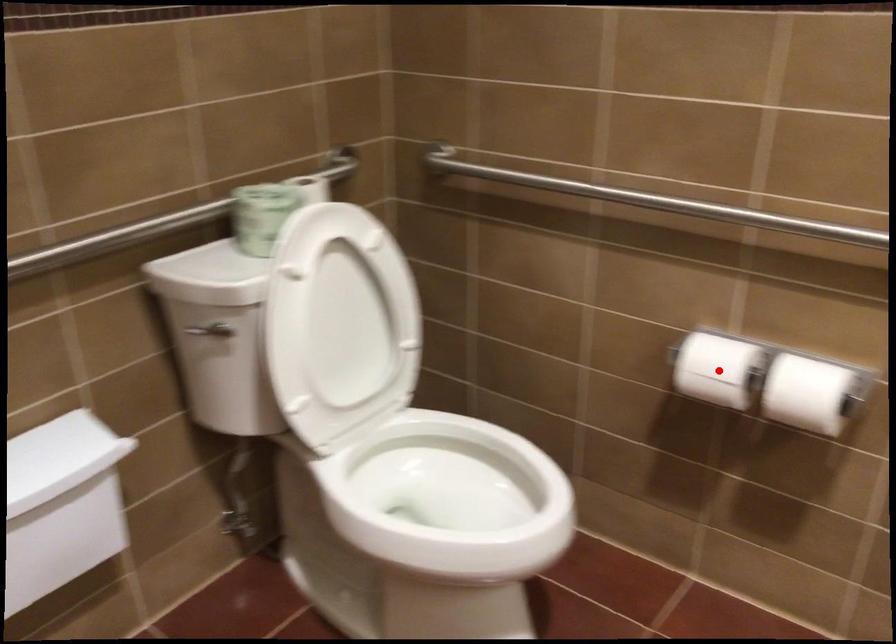
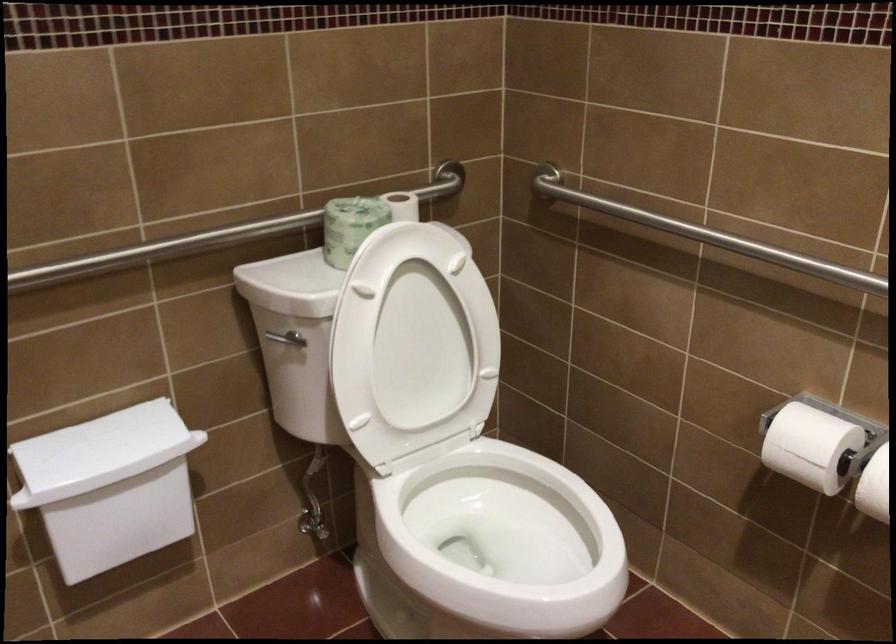
Question: A red point is marked in image1. In image2, is the corresponding 3D point closer to the camera or farther? Reply with the corresponding letter.

Choices:
 (A) The corresponding 3D point is closer.
 (B) The corresponding 3D point is farther.

Answer: (A)